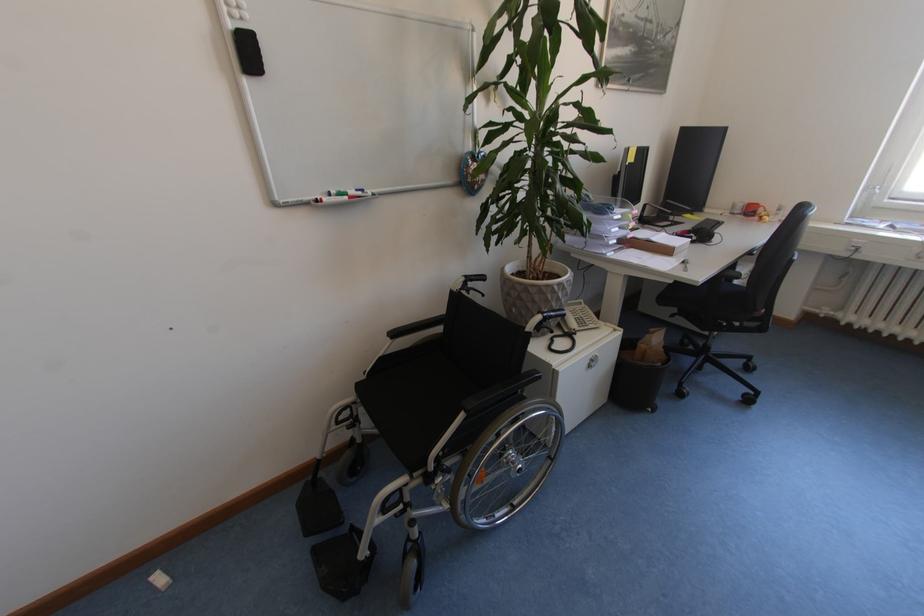
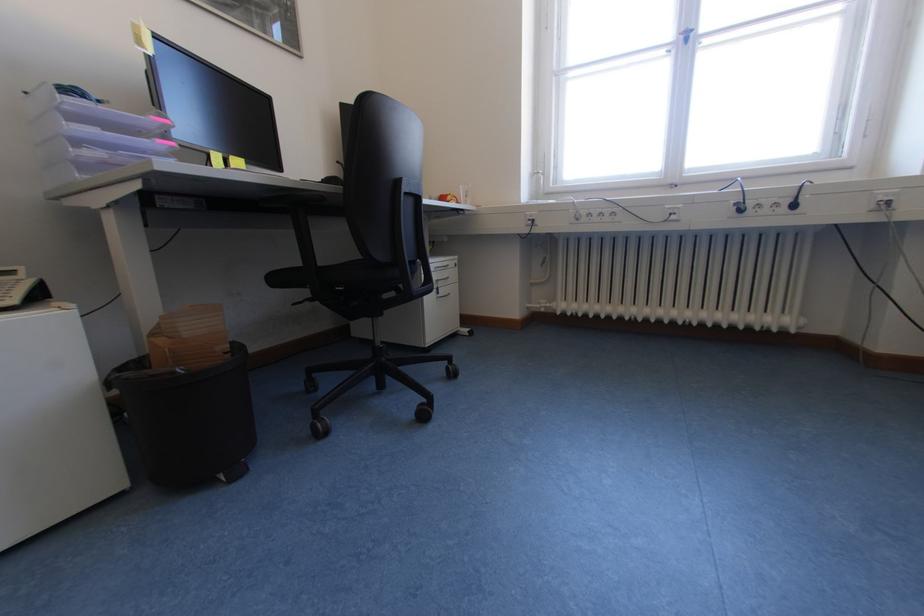
Where in the second image is the point corresponding to [830,317] from the first image?

(551, 310)